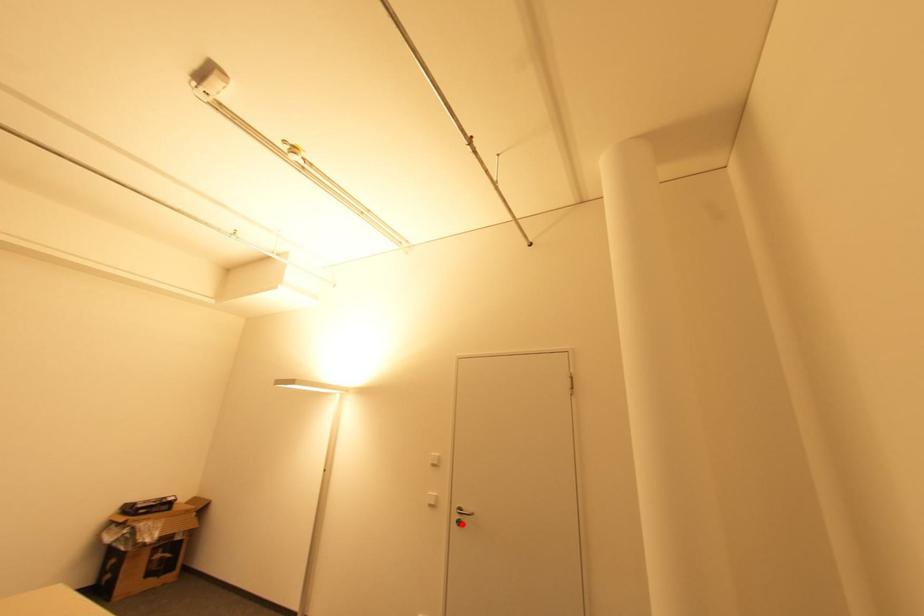
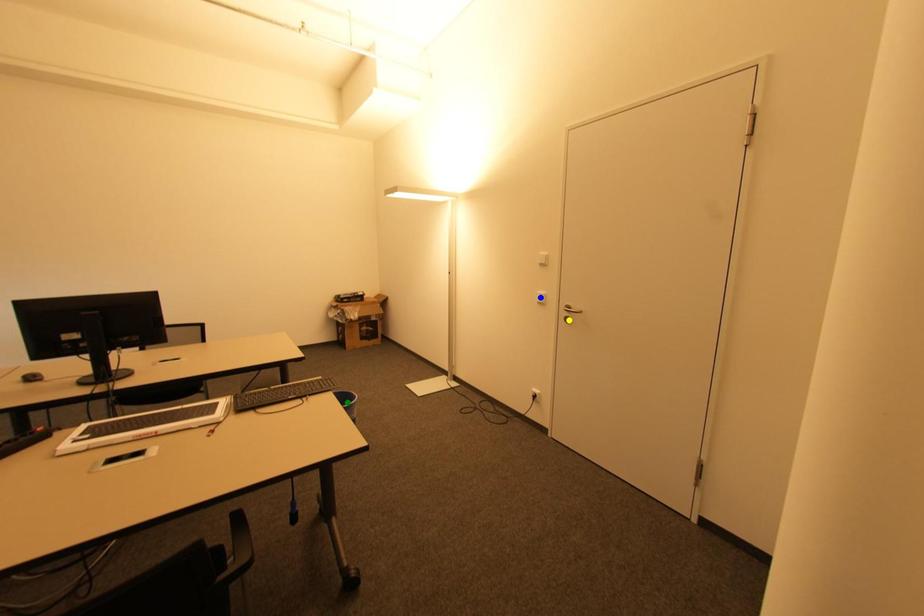
Question: I am providing you with two images of the same scene from different viewpoints. A red point is marked on the first image. You are given multiple points on the second image. Which spot in image 2 lines up with the point in image 1?

Choices:
 (A) yellow point
 (B) green point
 (C) blue point

Answer: (A)